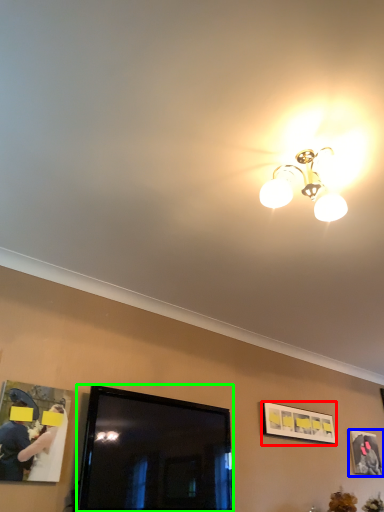
Question: Based on their relative distances, which object is nearer to picture frame (highlighted by a red box)? Choose from picture frame (highlighted by a blue box) and television (highlighted by a green box).

Choices:
 (A) picture frame
 (B) television

Answer: (A)